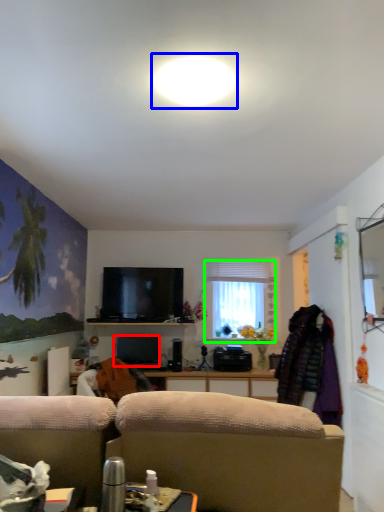
Question: Based on their relative distances, which object is farther from television (highlighted by a red box)? Choose from bright (highlighted by a blue box) and window (highlighted by a green box).

Choices:
 (A) bright
 (B) window

Answer: (A)